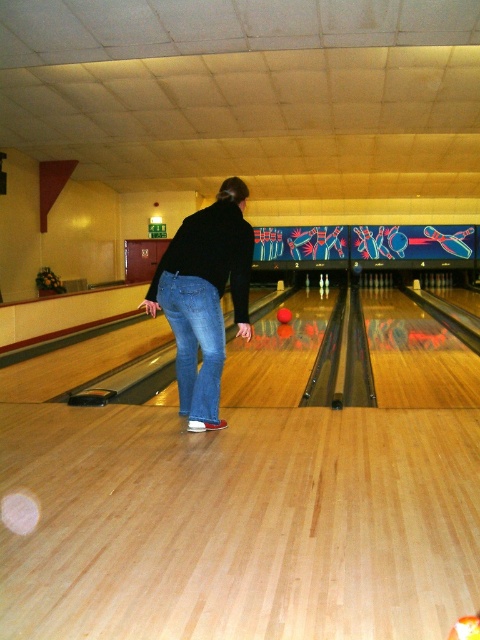
Question: Can you confirm if jeans at center is smaller than denim jeans at center?

Choices:
 (A) no
 (B) yes

Answer: (A)

Question: From the image, what is the correct spatial relationship of jeans at center in relation to denim jeans at center?

Choices:
 (A) left
 (B) right

Answer: (B)

Question: Which point is closer to the camera?

Choices:
 (A) jeans at center
 (B) denim jeans at center

Answer: (B)

Question: Does jeans at center have a greater width compared to denim jeans at center?

Choices:
 (A) no
 (B) yes

Answer: (B)

Question: Which point is closer to the camera taking this photo?

Choices:
 (A) (196, 408)
 (B) (235, 182)

Answer: (A)